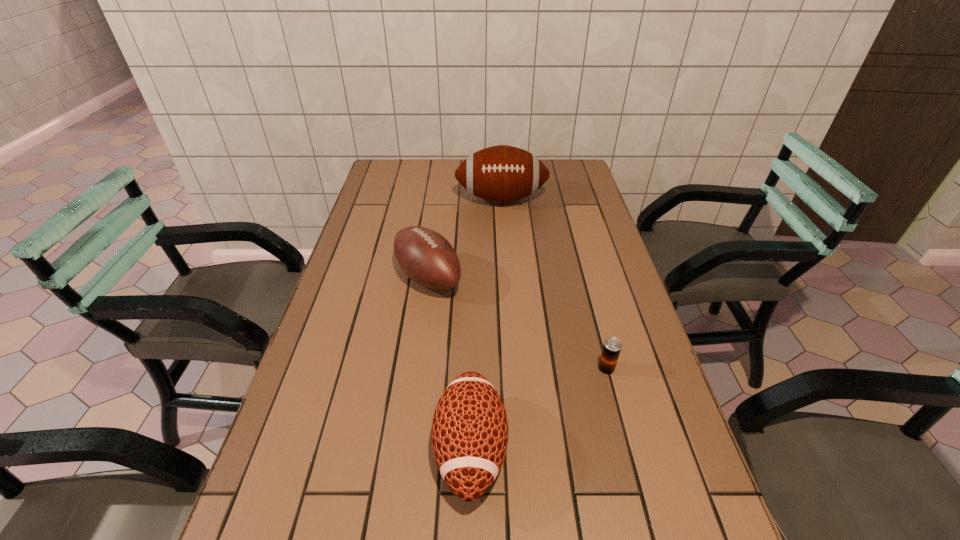
Where is `free spot that satisfies the following two spatial constraints: 1. on the laces of the farthest object; 2. on the left side of the beer can`? The width and height of the screenshot is (960, 540). free spot that satisfies the following two spatial constraints: 1. on the laces of the farthest object; 2. on the left side of the beer can is located at coordinates (513, 368).

This screenshot has height=540, width=960. I want to click on blank area in the image that satisfies the following two spatial constraints: 1. on the laces of the farthest football; 2. on the right side of the rightmost object, so click(513, 368).